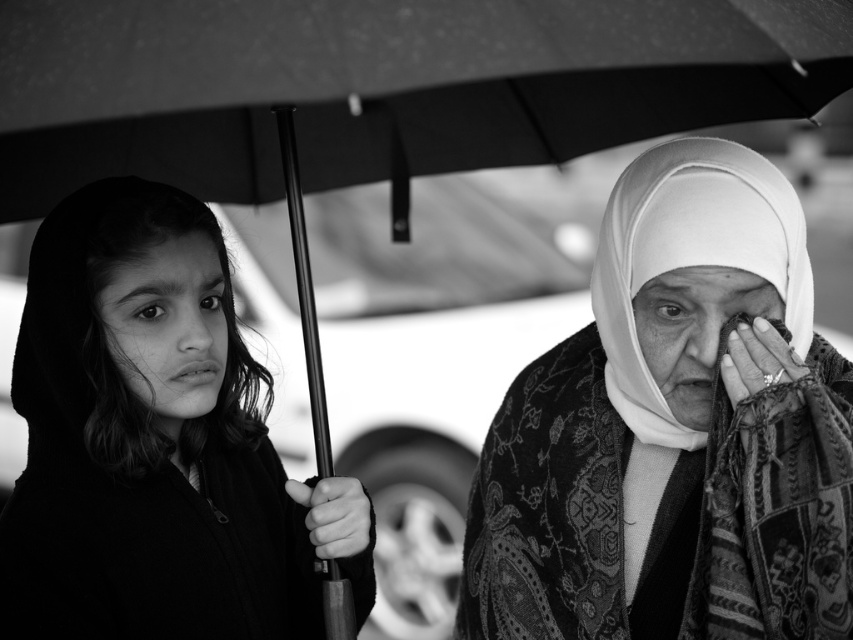
Based on the scene described, which face at the center has a greater height between the smooth skin face at center and the matte fabric face at center?

The smooth skin face at center has a greater height compared to the matte fabric face at center.

Based on the scene described, can you determine which object is wider between the patterned fabric headscarf at center and the smooth skin face at center?

The patterned fabric headscarf at center is wider than the smooth skin face at center according to the description.

You are a photographer analyzing this black and white photo. You notice the matte black hijab at upper right and the white textured veil at right. Which object is positioned closer to the left side of the frame?

The matte black hijab at upper right is positioned to the left of the white textured veil at right, so it is closer to the left side of the frame.